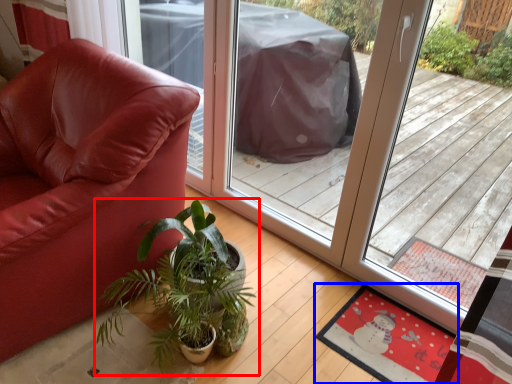
Question: Which object appears farthest to the camera in this image, houseplant (highlighted by a red box) or mat (highlighted by a blue box)?

Choices:
 (A) houseplant
 (B) mat

Answer: (B)